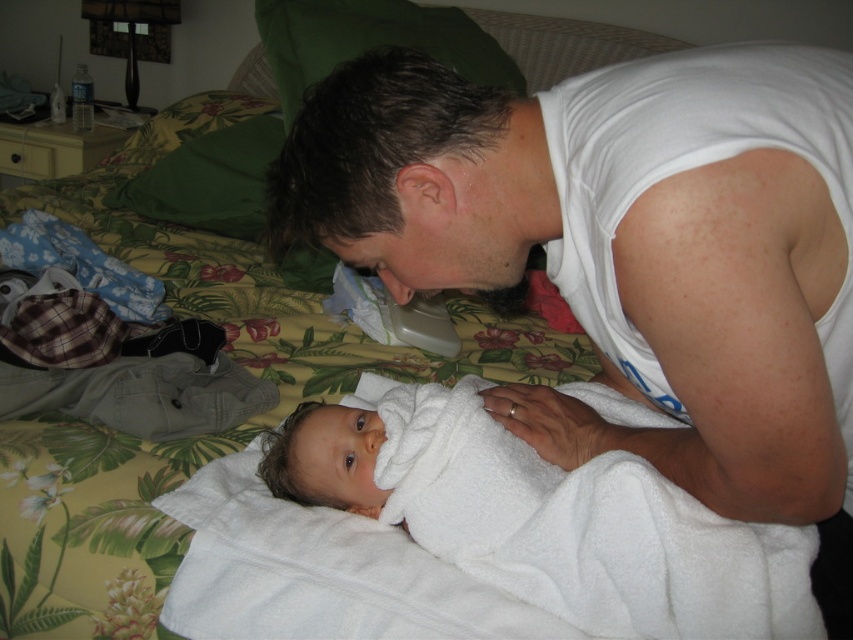
You need to place both the white cotton tank top at upper right and the white soft towel at center into a drawer. Which one should you fold first to ensure they both fit?

The white cotton tank top at upper right is larger in size than the white soft towel at center, so you should fold the white cotton tank top at upper right first to make space for the smaller item.

You are helping organize the baby items in the nursery. You need to place the white cotton tank top at upper right and the white soft towel at center. According to the image, which item is positioned to the right side of the other?

The white cotton tank top at upper right is to the right of the white soft towel at center.